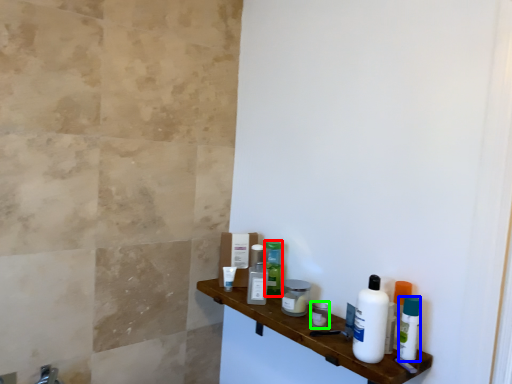
Question: Which is farther away from toiletry (highlighted by a red box)? mouthwash (highlighted by a blue box) or toiletry (highlighted by a green box)?

Choices:
 (A) mouthwash
 (B) toiletry

Answer: (A)